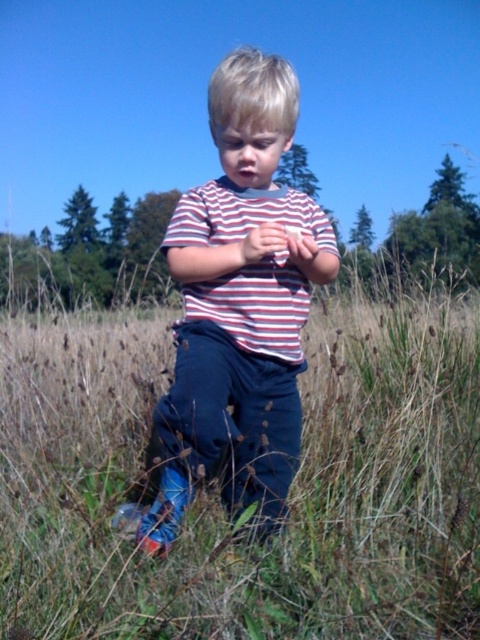
Who is more forward, [386,541] or [259,76]?

Point [259,76] is in front.

Describe the element at coordinates (217, 493) in the screenshot. I see `blue jeans at center` at that location.

The width and height of the screenshot is (480, 640). I want to click on blue jeans at center, so click(x=217, y=493).